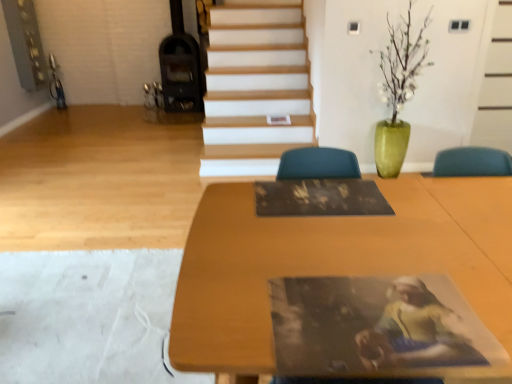
Question: Does wooden table at center appear on the left side of dark brown wood fireplace at upper left?

Choices:
 (A) no
 (B) yes

Answer: (A)

Question: Is wooden table at center wider than dark brown wood fireplace at upper left?

Choices:
 (A) no
 (B) yes

Answer: (B)

Question: Does wooden table at center appear on the right side of dark brown wood fireplace at upper left?

Choices:
 (A) yes
 (B) no

Answer: (A)

Question: Can you confirm if wooden table at center is shorter than dark brown wood fireplace at upper left?

Choices:
 (A) yes
 (B) no

Answer: (A)

Question: Is wooden table at center not inside dark brown wood fireplace at upper left?

Choices:
 (A) yes
 (B) no

Answer: (A)

Question: Could you tell me if wooden table at center is turned towards dark brown wood fireplace at upper left?

Choices:
 (A) no
 (B) yes

Answer: (A)

Question: Is dark brown wood fireplace at upper left wider than wooden table at center?

Choices:
 (A) yes
 (B) no

Answer: (B)

Question: Are dark brown wood fireplace at upper left and wooden table at center located far from each other?

Choices:
 (A) no
 (B) yes

Answer: (B)

Question: Is dark brown wood fireplace at upper left smaller than wooden table at center?

Choices:
 (A) no
 (B) yes

Answer: (B)

Question: Can you confirm if dark brown wood fireplace at upper left is positioned to the right of wooden table at center?

Choices:
 (A) yes
 (B) no

Answer: (B)

Question: Is wooden table at center completely or partially inside dark brown wood fireplace at upper left?

Choices:
 (A) no
 (B) yes

Answer: (A)

Question: Is dark brown wood fireplace at upper left facing away from wooden table at center?

Choices:
 (A) yes
 (B) no

Answer: (B)

Question: Considering the positions of point (151, 84) and point (500, 205), is point (151, 84) closer or farther from the camera than point (500, 205)?

Choices:
 (A) farther
 (B) closer

Answer: (A)